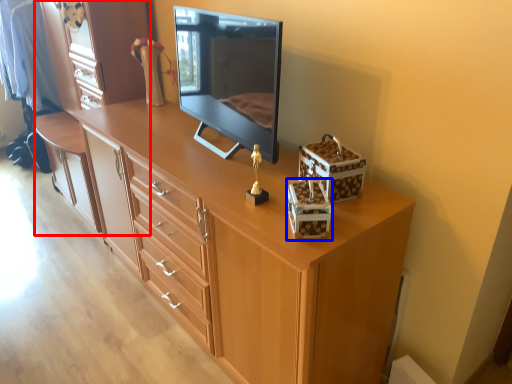
Question: Which object is closer to the camera taking this photo, dresser (highlighted by a red box) or storage box (highlighted by a blue box)?

Choices:
 (A) dresser
 (B) storage box

Answer: (B)